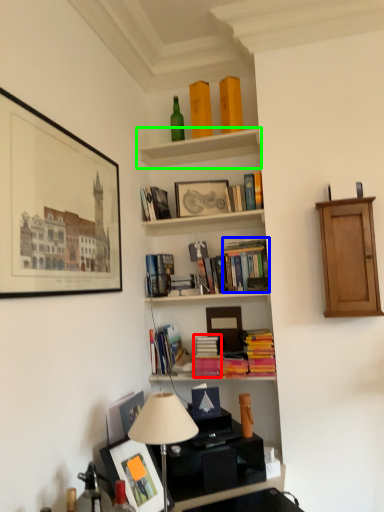
Question: Which object is the closest to the book (highlighted by a red box)? Choose among these: book (highlighted by a blue box) or shelf (highlighted by a green box).

Choices:
 (A) book
 (B) shelf

Answer: (A)